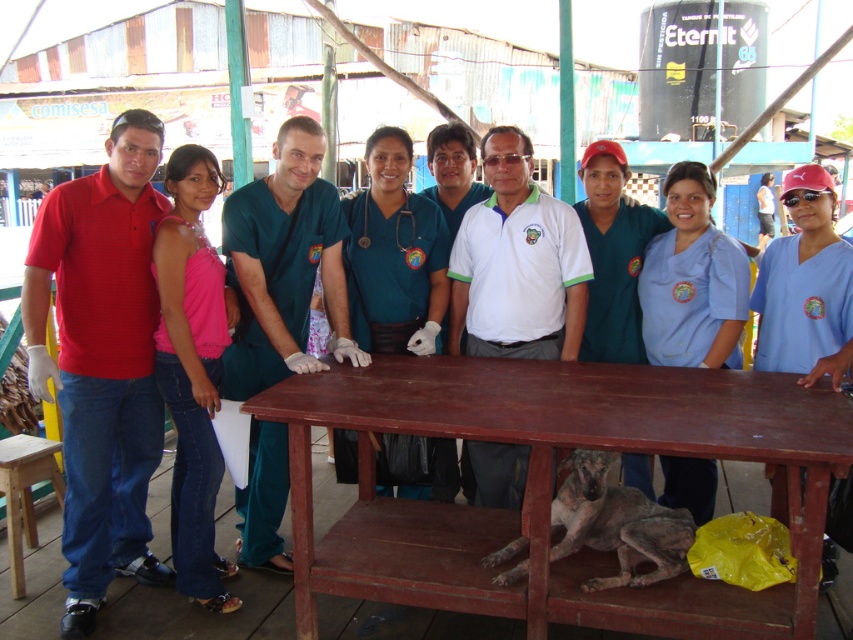
Can you confirm if brown wooden table at center is positioned above light blue scrubs at center?

No, brown wooden table at center is not above light blue scrubs at center.

Which is more to the left, brown wooden table at center or light blue scrubs at center?

brown wooden table at center is more to the left.

Is point (398, 504) farther from viewer compared to point (711, 342)?

That is False.

Find the location of a particular element. brown wooden table at center is located at coordinates (550, 484).

Is point (663, 253) in front of point (4, 445)?

No.

Which is more to the right, light blue scrubs at center or light brown wooden stool at lower left?

From the viewer's perspective, light blue scrubs at center appears more on the right side.

What do you see at coordinates (692, 280) in the screenshot? I see `light blue scrubs at center` at bounding box center [692, 280].

Find the location of a particular element. Image resolution: width=853 pixels, height=640 pixels. light blue scrubs at center is located at coordinates 692,280.

Does pink fabric top at left appear over light brown wooden stool at lower left?

Yes, pink fabric top at left is above light brown wooden stool at lower left.

Between point (207, 477) and point (51, 445), which one is positioned in front?

Point (207, 477)

The height and width of the screenshot is (640, 853). Describe the element at coordinates (193, 369) in the screenshot. I see `pink fabric top at left` at that location.

Identify the location of pink fabric top at left. This screenshot has height=640, width=853. (193, 369).